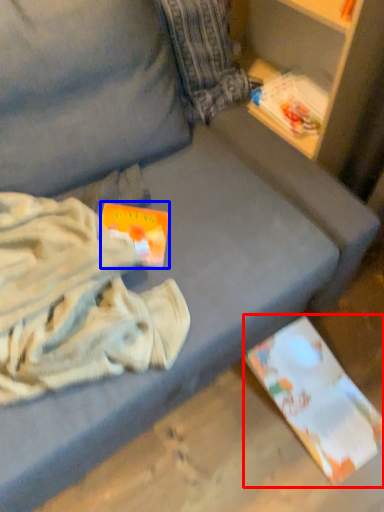
Question: Which point is further to the camera, paperback book (highlighted by a red box) or paperback book (highlighted by a blue box)?

Choices:
 (A) paperback book
 (B) paperback book

Answer: (A)